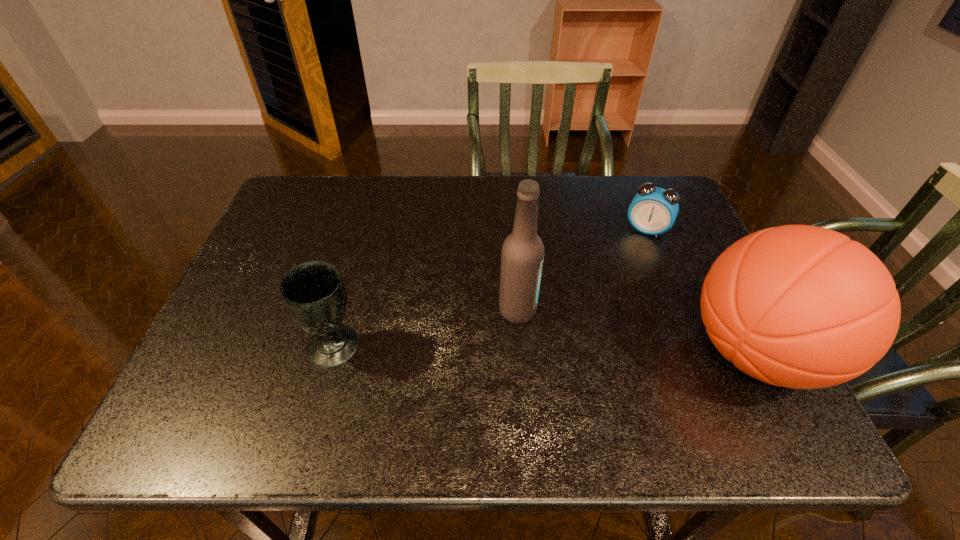
The width and height of the screenshot is (960, 540). In order to click on vacant spot on the desktop that is between the chalice and the basketball and is positioned on the face of the alarm clock in this screenshot , I will do `click(590, 350)`.

Find the location of a particular element. Image resolution: width=960 pixels, height=540 pixels. free space on the desktop that is between the chalice and the basketball and is positioned on the label of the second object from left to right is located at coordinates (603, 350).